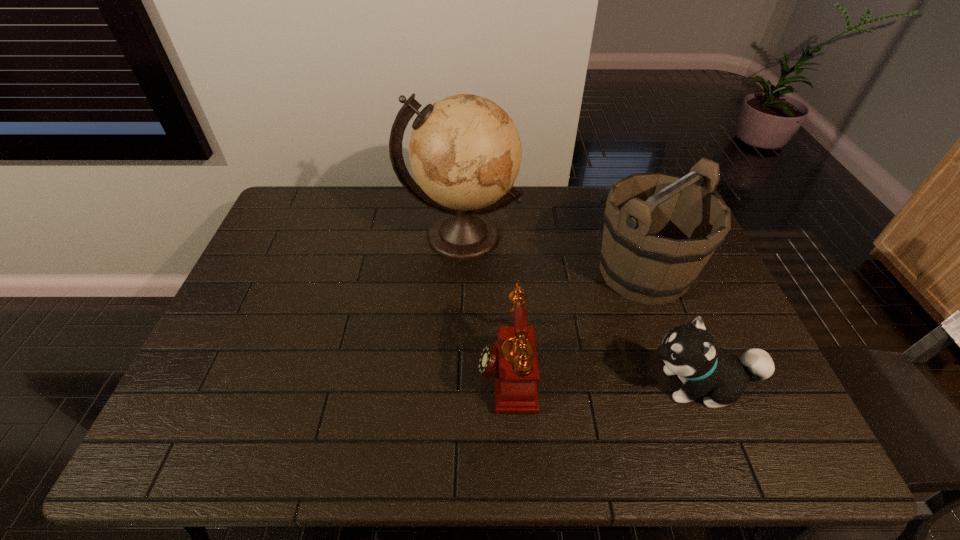
The image size is (960, 540). I want to click on the tallest object, so click(x=465, y=152).

This screenshot has height=540, width=960. Identify the location of the second tallest object. (660, 230).

Image resolution: width=960 pixels, height=540 pixels. Find the location of `telephone`. telephone is located at coordinates (513, 359).

At what (x,y) coordinates should I click in order to perform the action: click on puppy. Please return your answer as a coordinate pair (x, y). This screenshot has width=960, height=540. Looking at the image, I should click on pos(689,351).

At what (x,y) coordinates should I click in order to perform the action: click on blank space located 0.370m on the front-facing side of the globe. Please return your answer as a coordinate pair (x, y). Looking at the image, I should click on (455, 376).

Locate an element on the screen. vacant space located on the front of the third shortest object is located at coordinates (677, 365).

I want to click on free spot located on the dial of the telephone, so click(382, 369).

Locate an element on the screen. This screenshot has width=960, height=540. vacant space located 0.240m on the dial of the telephone is located at coordinates (382, 369).

Where is `vacant area located on the dial of the telephone`? This screenshot has height=540, width=960. vacant area located on the dial of the telephone is located at coordinates (430, 369).

Identify the location of vacant space located 0.400m at the face of the puppy. (476, 385).